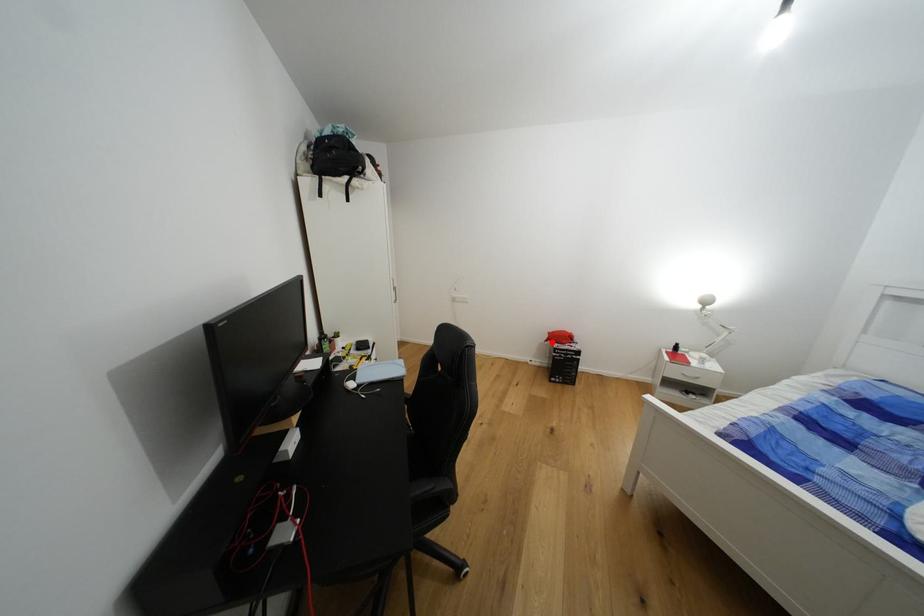
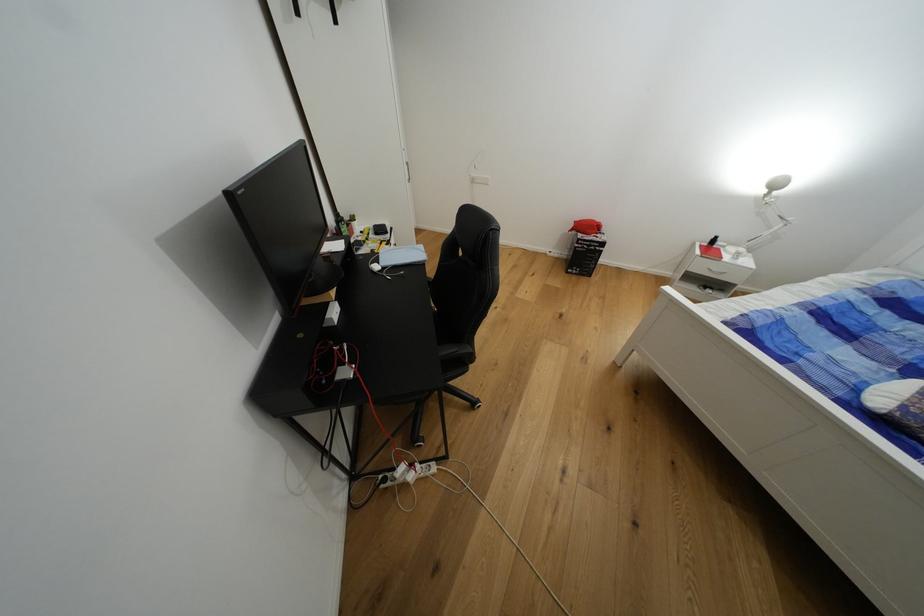
Question: I am providing you with two images of the same scene from different viewpoints. In image1, a red point is highlighted. Considering the same 3D point in image2, which of the following is correct?

Choices:
 (A) It is closer
 (B) It is farther

Answer: (A)